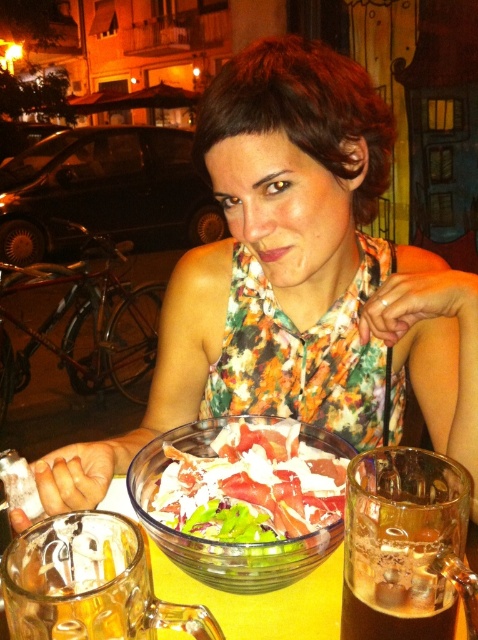
Who is positioned more to the left, translucent glass mug at lower right or yellow glass table at center?

Positioned to the left is yellow glass table at center.

Does translucent glass mug at lower right appear over yellow glass table at center?

Yes.

Is point (454, 484) positioned in front of point (336, 621)?

That is True.

I want to click on translucent glass mug at lower right, so click(x=403, y=545).

Is translucent glass bowl at center positioned behind yellow glass table at center?

That is False.

Is translucent glass bowl at center below yellow glass table at center?

No, translucent glass bowl at center is not below yellow glass table at center.

Is point (256, 486) less distant than point (319, 568)?

Yes, point (256, 486) is closer to viewer.

Locate an element on the screen. translucent glass bowl at center is located at coordinates (228, 541).

Between translucent glass mug at lower right and translucent glass bowl at center, which one is positioned higher?

translucent glass mug at lower right is higher up.

Can you confirm if translucent glass mug at lower right is positioned below translucent glass bowl at center?

Incorrect, translucent glass mug at lower right is not positioned below translucent glass bowl at center.

Between point (390, 636) and point (158, 456), which one is positioned behind?

The point (158, 456) is behind.

Find the location of a particular element. translucent glass mug at lower right is located at coordinates (403, 545).